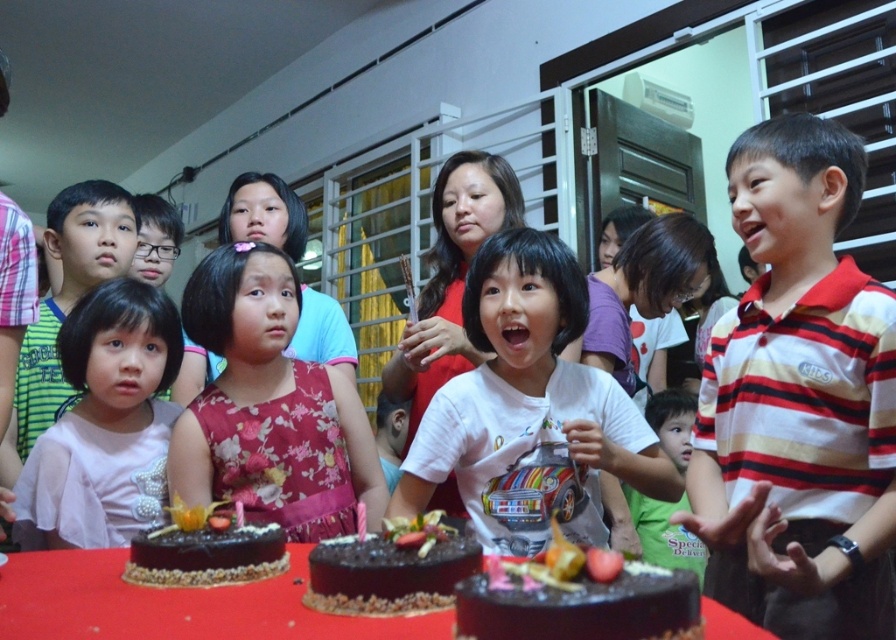
Does pink floral dress at center appear on the right side of green cotton shirt at center?

In fact, pink floral dress at center is to the left of green cotton shirt at center.

Is pink floral dress at center further to camera compared to green cotton shirt at center?

No, it is in front of green cotton shirt at center.

Which is in front, point (190, 314) or point (677, 388)?

Positioned in front is point (190, 314).

At what (x,y) coordinates should I click in order to perform the action: click on pink floral dress at center. Please return your answer as a coordinate pair (x, y). Image resolution: width=896 pixels, height=640 pixels. Looking at the image, I should click on (269, 404).

Is striped cotton shirt at right behind chocolate frosted cake at lower left?

Yes, it is.

Does striped cotton shirt at right have a larger size compared to chocolate frosted cake at lower left?

Yes.

Is point (734, 580) positioned in front of point (162, 536)?

No.

This screenshot has width=896, height=640. Identify the location of striped cotton shirt at right. (798, 401).

Measure the distance between pink fabric dress at lower left and camera.

pink fabric dress at lower left and camera are 4.80 feet apart.

You are a GUI agent. You are given a task and a screenshot of the screen. Output one action in this format:
    pyautogui.click(x=<x>, y=<y>)
    Task: Click on the pink fabric dress at lower left
    The height and width of the screenshot is (640, 896).
    Given the screenshot: What is the action you would take?
    pyautogui.click(x=102, y=419)